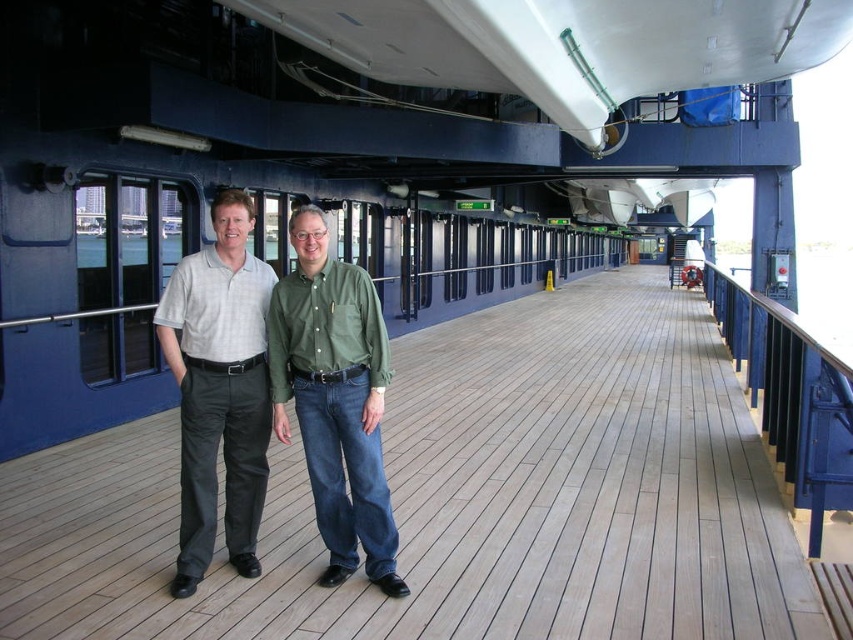
Question: Does wooden at center appear over matte green shirt at center?

Choices:
 (A) yes
 (B) no

Answer: (B)

Question: Is wooden at center bigger than matte green shirt at center?

Choices:
 (A) no
 (B) yes

Answer: (B)

Question: Which object is positioned farthest from the wooden at center?

Choices:
 (A) gray cotton shirt at center
 (B) matte green shirt at center

Answer: (A)

Question: Which of the following is the closest to the observer?

Choices:
 (A) (224, 452)
 (B) (178, 317)

Answer: (B)

Question: Based on their relative distances, which object is nearer to the matte green shirt at center?

Choices:
 (A) wooden at center
 (B) gray cotton shirt at center

Answer: (B)

Question: Does matte green shirt at center have a lesser width compared to gray cotton shirt at center?

Choices:
 (A) no
 (B) yes

Answer: (A)